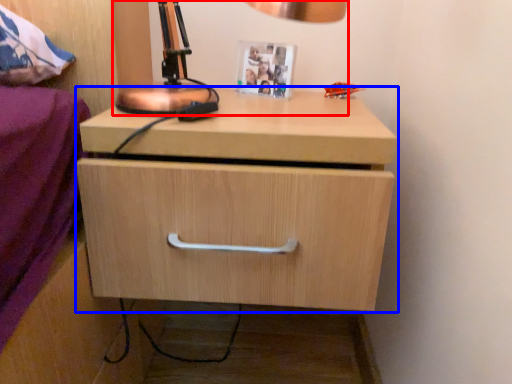
Question: Among these objects, which one is farthest to the camera, table lamp (highlighted by a red box) or chest of drawers (highlighted by a blue box)?

Choices:
 (A) table lamp
 (B) chest of drawers

Answer: (B)